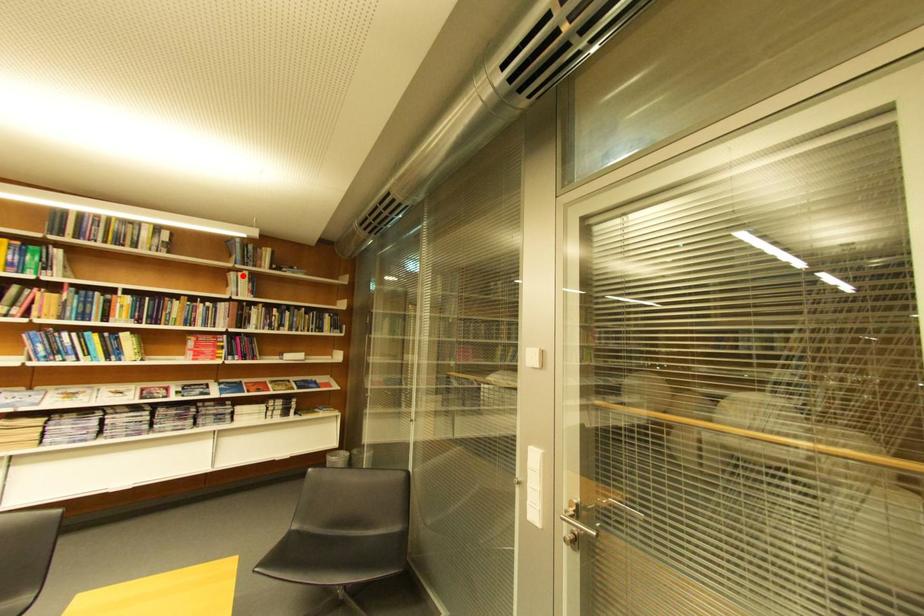
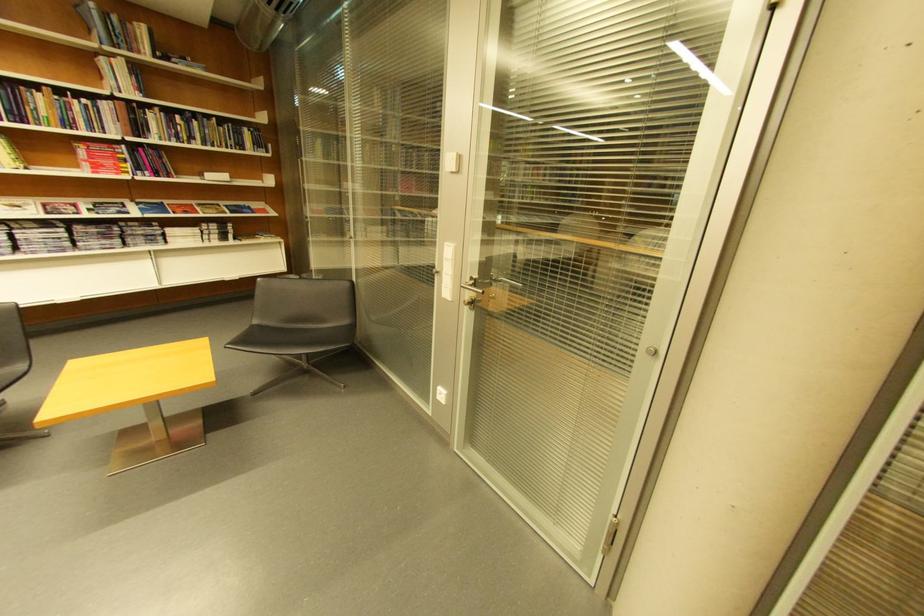
In the second image, find the point that corresponds to the highlighted location in the first image.

(113, 62)